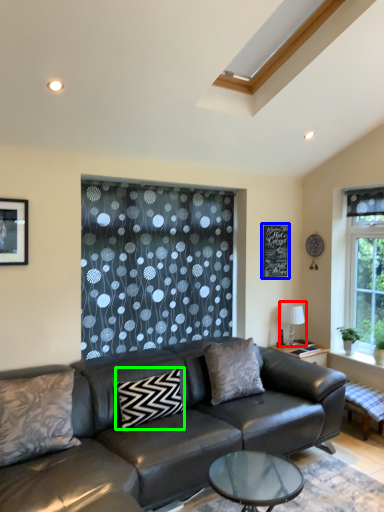
Question: Based on their relative distances, which object is nearer to lamp (highlighted by a red box)? Choose from bulletin board (highlighted by a blue box) and pillow (highlighted by a green box).

Choices:
 (A) bulletin board
 (B) pillow

Answer: (A)